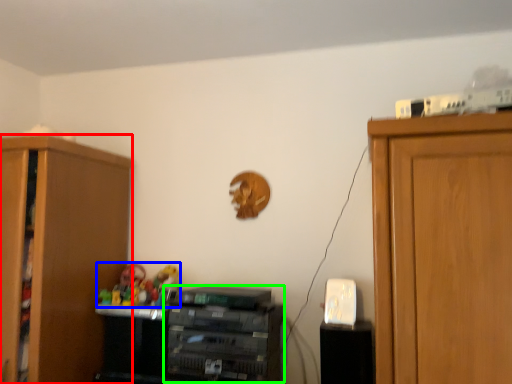
Question: Which is nearer to the cabinetry (highlighted by a red box)? toy (highlighted by a blue box) or cabinetry (highlighted by a green box).

Choices:
 (A) toy
 (B) cabinetry

Answer: (A)